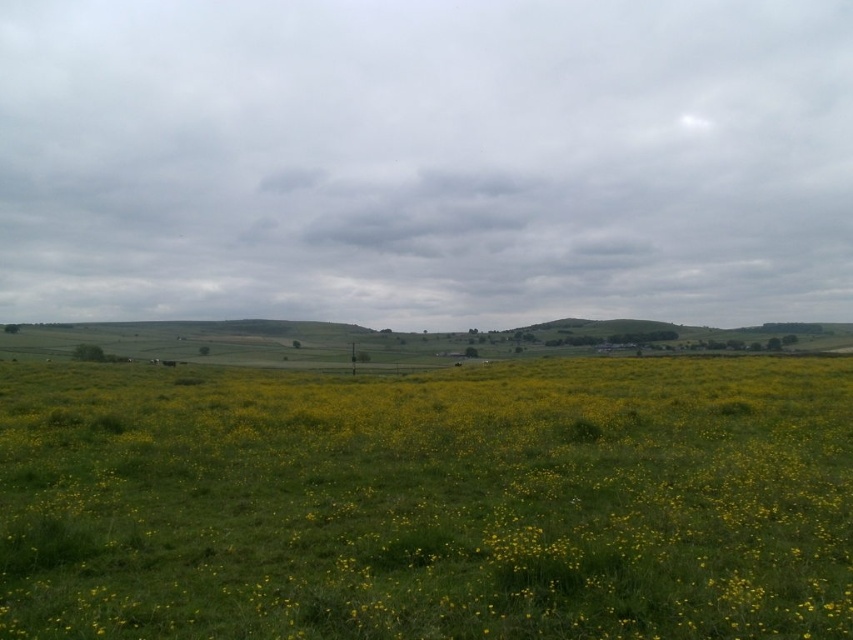
You are standing in the middle of the field and looking up at the cloudy sky at center and the yellow grass at center. Which object is located to the left of the other?

The cloudy sky at center is positioned on the left side of yellow grass at center.